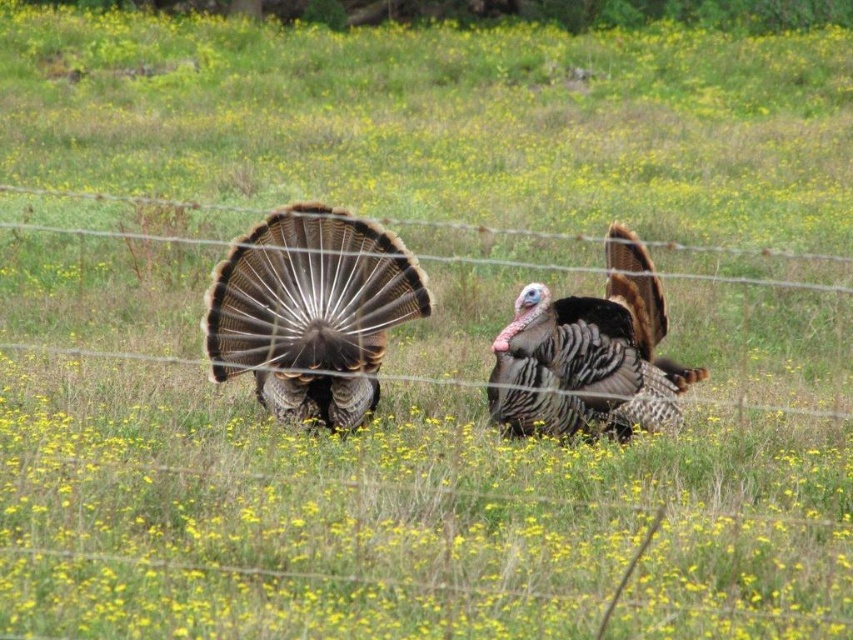
Based on the photo, can you confirm if feathered brown turkey at center is positioned to the right of speckled feathered turkey at center?

No, feathered brown turkey at center is not to the right of speckled feathered turkey at center.

I want to click on feathered brown turkey at center, so click(x=311, y=310).

This screenshot has height=640, width=853. I want to click on feathered brown turkey at center, so click(311, 310).